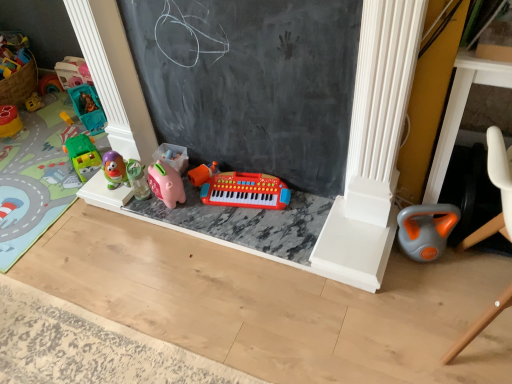
Locate an element on the screen. Image resolution: width=512 pixels, height=384 pixels. free space to the right of pink rubber piggy bank at center, which is the 5th toy from left to right is located at coordinates (206, 208).